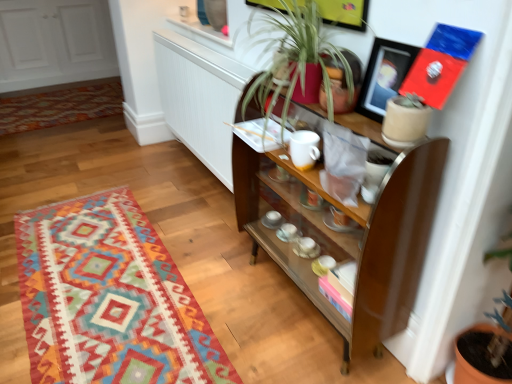
Question: From the image's perspective, relative to multicolored woven rug at lower left, the first mat when ordered from back to front, is brown wooden shelf at center above or below?

Choices:
 (A) below
 (B) above

Answer: (A)

Question: In terms of size, does brown wooden shelf at center appear bigger or smaller than multicolored woven rug at lower left, placed as the second mat when sorted from bottom to top?

Choices:
 (A) big
 (B) small

Answer: (A)

Question: Which of these objects is positioned farthest from the matte black picture frame at upper right?

Choices:
 (A) green leafy plant at center
 (B) textured wool rug at lower left, placed as the 1th mat when sorted from front to back
 (C) brown wooden shelf at center
 (D) multicolored woven rug at lower left, the first mat when ordered from back to front

Answer: (D)

Question: Based on their relative distances, which object is farther from the brown wooden shelf at center?

Choices:
 (A) multicolored woven rug at lower left, positioned as the second mat in front-to-back order
 (B) matte black picture frame at upper right
 (C) textured wool rug at lower left, the 2th mat when ordered from back to front
 (D) green leafy plant at center

Answer: (A)